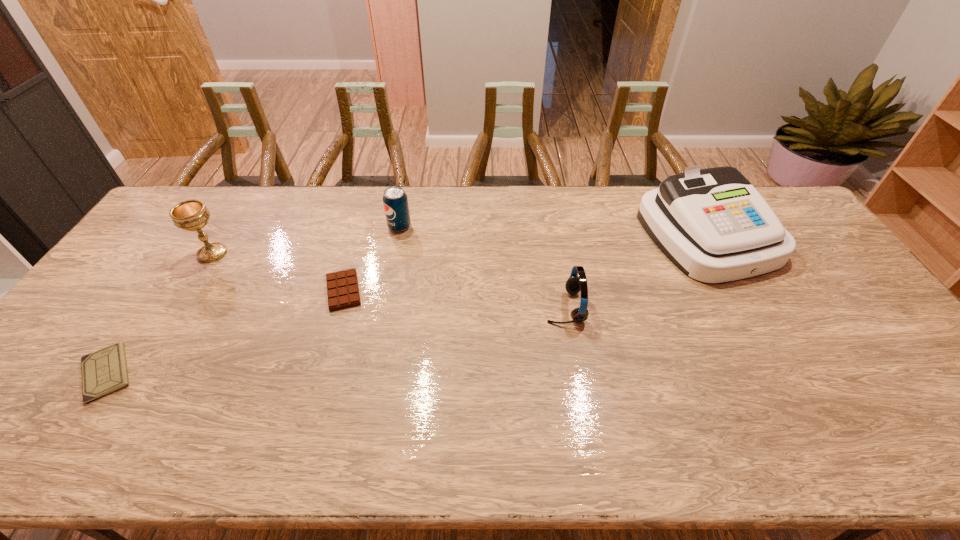
Find the location of a particular element. the rightmost object is located at coordinates click(712, 224).

Find the location of a particular element. The height and width of the screenshot is (540, 960). chalice is located at coordinates 191,215.

Where is `soda can`? The image size is (960, 540). soda can is located at coordinates (395, 201).

The image size is (960, 540). Identify the location of the second object from right to left. (574, 284).

Identify the location of the second shortest object. (342, 286).

Locate an element on the screen. candy bar is located at coordinates (342, 286).

Find the location of a particular element. This screenshot has height=540, width=960. the shortest object is located at coordinates point(105,371).

Find the location of a particular element. The width and height of the screenshot is (960, 540). the nearest object is located at coordinates (105, 371).

You are a GUI agent. You are given a task and a screenshot of the screen. Output one action in this format:
    pyautogui.click(x=<x>, y=<y>)
    Task: Click on the vacant space positioned on the front of the cash register
    This screenshot has width=960, height=540.
    Given the screenshot: What is the action you would take?
    pyautogui.click(x=780, y=367)

I want to click on blank area located 0.360m on the right of the chalice, so click(344, 254).